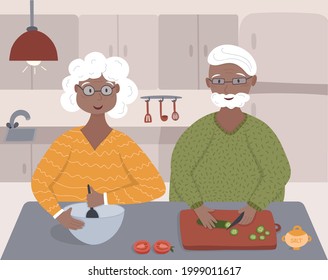
The image size is (328, 280). Identify the location of gray and slight purple cabinets. (192, 51), (128, 43), (59, 28).